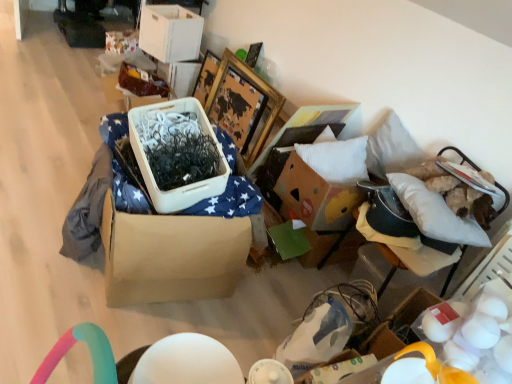
Find the location of a particular element. The height and width of the screenshot is (384, 512). vacant area on top of matte brown storage box at upper left, acting as the 2th storage box starting from the top (from a real-world perspective) is located at coordinates (139, 60).